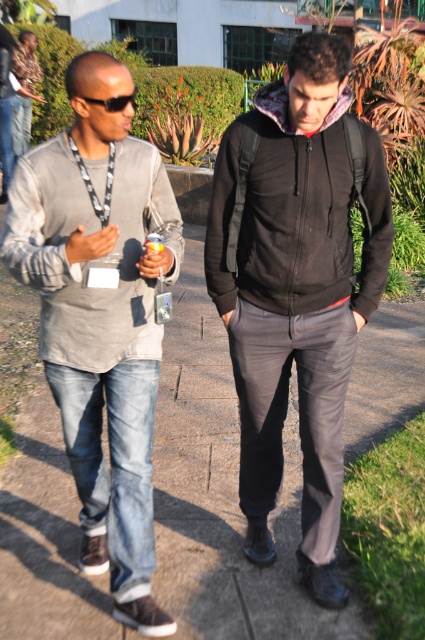
You are a fashion designer observing two people in an outdoor setting. You notice the black matte hoodie at center and the gray cotton jacket at left. Which clothing item appears bigger in size?

The black matte hoodie at center is larger in size than the gray cotton jacket at left.